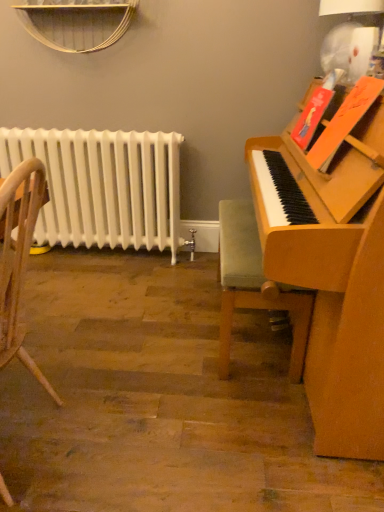
In order to click on wooden chair at left, which appears as the second chair when viewed from the right in this screenshot , I will do `click(19, 258)`.

Locate an element on the screen. The image size is (384, 512). white painted metal radiator at left is located at coordinates (103, 186).

Can you confirm if white painted metal radiator at left is bigger than wooden chair at left, the 1th chair when ordered from left to right?

Correct, white painted metal radiator at left is larger in size than wooden chair at left, the 1th chair when ordered from left to right.

Is white painted metal radiator at left oriented away from wooden chair at left, arranged as the first chair when viewed from the front?

That's not correct — white painted metal radiator at left is not looking away from wooden chair at left, arranged as the first chair when viewed from the front.

Locate an element on the screen. radiator that appears on the left of wooden chair at left, the 1th chair when ordered from left to right is located at coordinates (103, 186).

Would you say white painted metal radiator at left contains wooden chair at left, arranged as the first chair when viewed from the front?

Definitely not — wooden chair at left, arranged as the first chair when viewed from the front, is not inside white painted metal radiator at left.

Considering the relative sizes of wooden chair at left, the 1th chair when ordered from left to right, and white painted metal radiator at left in the image provided, is wooden chair at left, the 1th chair when ordered from left to right, shorter than white painted metal radiator at left?

Answer: In fact, wooden chair at left, the 1th chair when ordered from left to right, may be taller than white painted metal radiator at left.

Is wooden chair at left, the 1th chair when ordered from left to right, placed right next to white painted metal radiator at left?

No, wooden chair at left, the 1th chair when ordered from left to right, is not with white painted metal radiator at left.

Does wooden chair at left, the 1th chair when ordered from left to right, appear on the left side of white painted metal radiator at left?

In fact, wooden chair at left, the 1th chair when ordered from left to right, is to the right of white painted metal radiator at left.

Is white painted metal radiator at left positioned far away from velvet green cushioned chair at right, placed as the second chair when sorted from front to back?

That's not correct — white painted metal radiator at left is a little close to velvet green cushioned chair at right, placed as the second chair when sorted from front to back.

Is white painted metal radiator at left aimed at velvet green cushioned chair at right, which is counted as the second chair, starting from the left?

No, white painted metal radiator at left is not facing towards velvet green cushioned chair at right, which is counted as the second chair, starting from the left.

Is white painted metal radiator at left bigger than velvet green cushioned chair at right, which is counted as the second chair, starting from the left?

Correct, white painted metal radiator at left is larger in size than velvet green cushioned chair at right, which is counted as the second chair, starting from the left.

Looking at this image, can you confirm if velvet green cushioned chair at right, the 1th chair viewed from the right, is shorter than white painted metal radiator at left?

Yes, velvet green cushioned chair at right, the 1th chair viewed from the right, is shorter than white painted metal radiator at left.

How far apart are velvet green cushioned chair at right, placed as the second chair when sorted from front to back, and white painted metal radiator at left?

36.96 inches.

Considering the relative sizes of velvet green cushioned chair at right, which is counted as the second chair, starting from the left, and white painted metal radiator at left in the image provided, is velvet green cushioned chair at right, which is counted as the second chair, starting from the left, wider than white painted metal radiator at left?

Yes, velvet green cushioned chair at right, which is counted as the second chair, starting from the left, is wider than white painted metal radiator at left.

Who is smaller, velvet green cushioned chair at right, placed as the second chair when sorted from front to back, or white painted metal radiator at left?

Smaller between the two is velvet green cushioned chair at right, placed as the second chair when sorted from front to back.

Is wooden chair at left, which appears as the second chair when viewed from the right, directly adjacent to velvet green cushioned chair at right, which is counted as the second chair, starting from the left?

No, wooden chair at left, which appears as the second chair when viewed from the right, is not touching velvet green cushioned chair at right, which is counted as the second chair, starting from the left.

Between wooden chair at left, arranged as the first chair when viewed from the front, and velvet green cushioned chair at right, placed as the second chair when sorted from front to back, which one has smaller width?

Thinner between the two is velvet green cushioned chair at right, placed as the second chair when sorted from front to back.

From the image's perspective, is wooden chair at left, which is counted as the second chair, starting from the back, above velvet green cushioned chair at right, the 1th chair viewed from the right?

Actually, wooden chair at left, which is counted as the second chair, starting from the back, appears below velvet green cushioned chair at right, the 1th chair viewed from the right, in the image.

Does wooden chair at left, which appears as the second chair when viewed from the right, come behind velvet green cushioned chair at right, the first chair in the back-to-front sequence?

That is False.

In terms of height, does velvet green cushioned chair at right, placed as the second chair when sorted from front to back, look taller or shorter compared to wooden chair at left, which appears as the second chair when viewed from the right?

velvet green cushioned chair at right, placed as the second chair when sorted from front to back, is shorter than wooden chair at left, which appears as the second chair when viewed from the right.

Is velvet green cushioned chair at right, the first chair in the back-to-front sequence, surrounding wooden chair at left, which appears as the second chair when viewed from the right?

Definitely not — wooden chair at left, which appears as the second chair when viewed from the right, is not inside velvet green cushioned chair at right, the first chair in the back-to-front sequence.

Measure the distance from velvet green cushioned chair at right, the 1th chair viewed from the right, to wooden chair at left, the 1th chair when ordered from left to right.

velvet green cushioned chair at right, the 1th chair viewed from the right, is 77.26 centimeters away from wooden chair at left, the 1th chair when ordered from left to right.

Is velvet green cushioned chair at right, which is counted as the second chair, starting from the left, facing away from wooden chair at left, the 1th chair when ordered from left to right?

velvet green cushioned chair at right, which is counted as the second chair, starting from the left, is not turned away from wooden chair at left, the 1th chair when ordered from left to right.

The width and height of the screenshot is (384, 512). Identify the location of radiator behind the wooden chair at left, the 1th chair when ordered from left to right. (103, 186).

The image size is (384, 512). In order to click on radiator below the wooden chair at left, which is counted as the second chair, starting from the back (from a real-world perspective) in this screenshot , I will do `click(103, 186)`.

From the image, which object appears to be farther from white painted metal radiator at left, wooden chair at left, which is counted as the second chair, starting from the back, or velvet green cushioned chair at right, the 1th chair viewed from the right?

The object further to white painted metal radiator at left is wooden chair at left, which is counted as the second chair, starting from the back.

Considering their positions, is velvet green cushioned chair at right, the 1th chair viewed from the right, positioned closer to wooden chair at left, arranged as the first chair when viewed from the front, than white painted metal radiator at left?

velvet green cushioned chair at right, the 1th chair viewed from the right.

Considering their positions, is white painted metal radiator at left positioned closer to wooden chair at left, which is counted as the second chair, starting from the back, than velvet green cushioned chair at right, the first chair in the back-to-front sequence?

Answer: Among the two, velvet green cushioned chair at right, the first chair in the back-to-front sequence, is located nearer to wooden chair at left, which is counted as the second chair, starting from the back.

When comparing their distances from velvet green cushioned chair at right, placed as the second chair when sorted from front to back, does white painted metal radiator at left or wooden chair at left, which is counted as the second chair, starting from the back, seem further?

Among the two, white painted metal radiator at left is located further to velvet green cushioned chair at right, placed as the second chair when sorted from front to back.

In the scene shown: When comparing their distances from white painted metal radiator at left, does velvet green cushioned chair at right, placed as the second chair when sorted from front to back, or wooden chair at left, arranged as the first chair when viewed from the front, seem closer?

The object closer to white painted metal radiator at left is velvet green cushioned chair at right, placed as the second chair when sorted from front to back.

Looking at the image, which one is located further to velvet green cushioned chair at right, the 1th chair viewed from the right, wooden chair at left, arranged as the first chair when viewed from the front, or white painted metal radiator at left?

white painted metal radiator at left.

This screenshot has width=384, height=512. What are the coordinates of `chair positioned between wooden chair at left, which is counted as the second chair, starting from the back, and white painted metal radiator at left from near to far` in the screenshot? It's located at (255, 285).